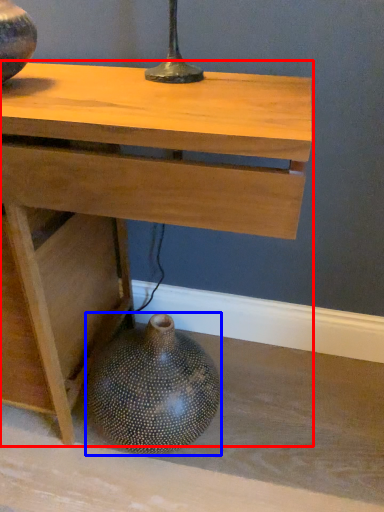
Question: Among these objects, which one is nearest to the camera, table (highlighted by a red box) or vase (highlighted by a blue box)?

Choices:
 (A) table
 (B) vase

Answer: (A)